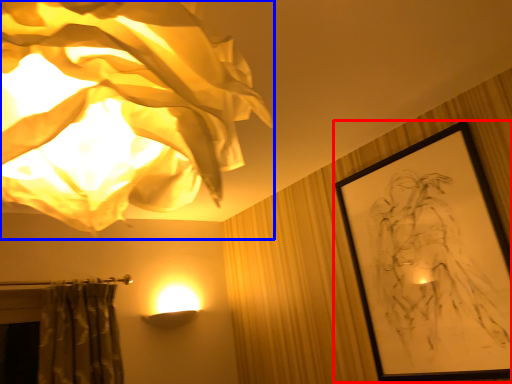
Question: Which of the following is the farthest to the observer, picture frame (highlighted by a red box) or lamp (highlighted by a blue box)?

Choices:
 (A) picture frame
 (B) lamp

Answer: (A)